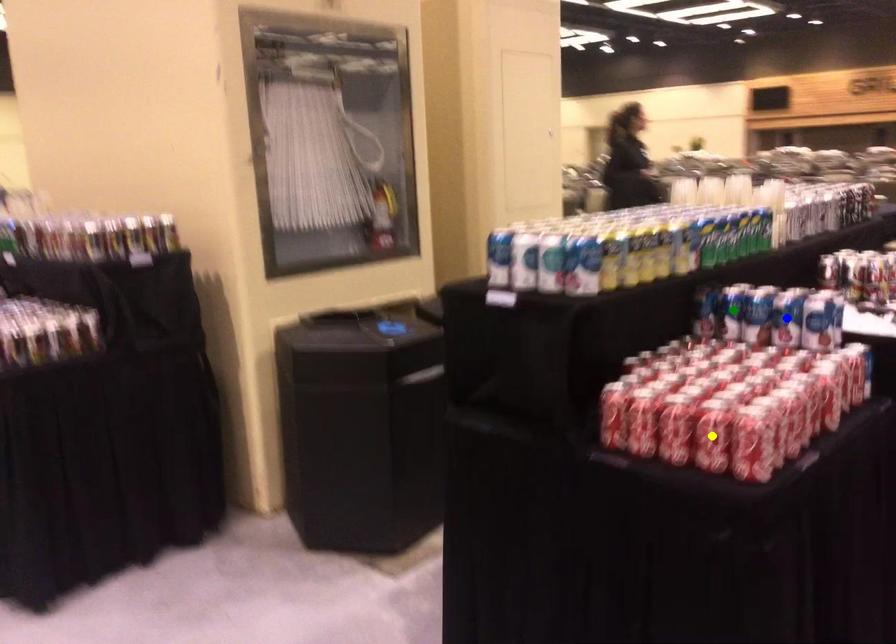
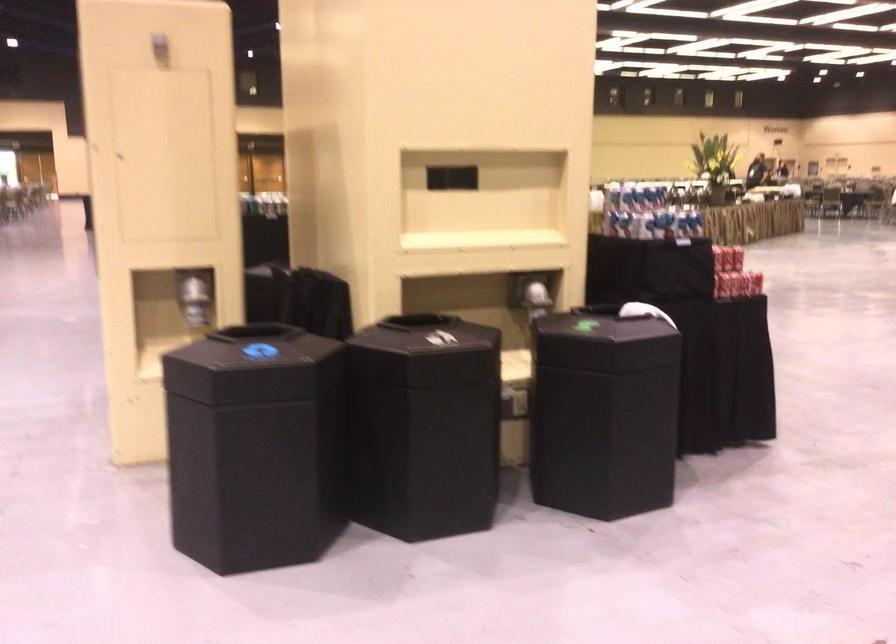
I am providing you with two images of the same scene from different viewpoints. Three points are marked in image1. Which point corresponds to a part or object that is occluded in image2?In image1, three points are marked. Which of them correspond to a part or object that is occluded in image2?Among the three points shown in image1, which one corresponds to a part or object that is no longer visible due to occlusion in image2?

blue point, green point, yellow point